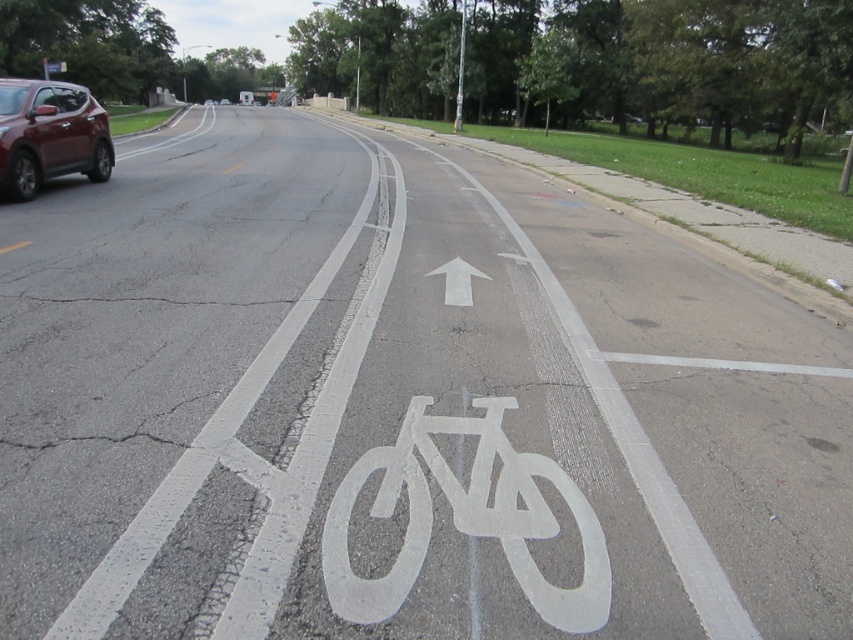
Does white painted bicycle at center have a lesser height compared to matte red suv at left?

Correct, white painted bicycle at center is not as tall as matte red suv at left.

Which of these two, white painted bicycle at center or matte red suv at left, stands shorter?

With less height is white painted bicycle at center.

Which is in front, point (444, 461) or point (13, 186)?

Point (444, 461)

Identify the location of white painted bicycle at center. (465, 516).